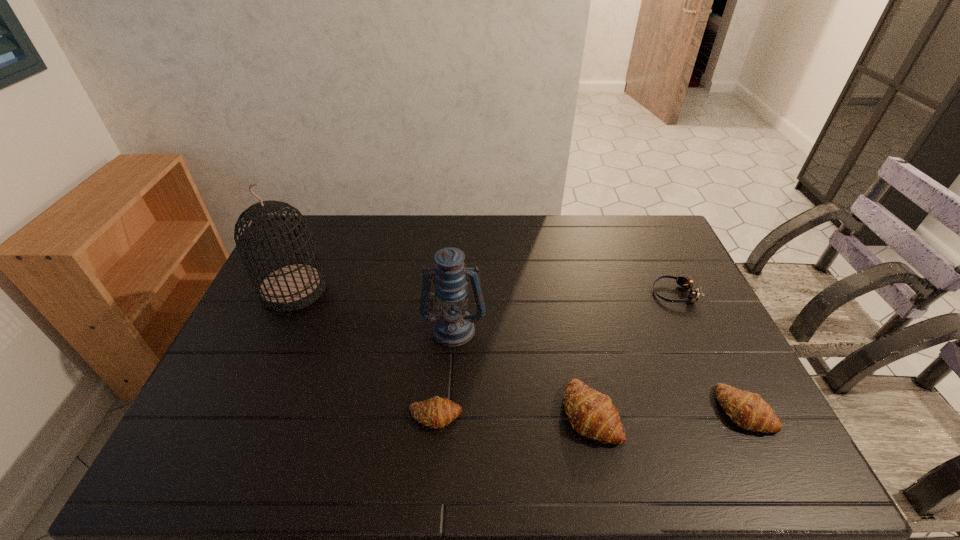
Please show where to add a crescent roll on the left while keeping spacing even. Please provide its 2D coordinates. Your answer should be formatted as a tuple, i.e. [(x, y)], where the tuple contains the x and y coordinates of a point satisfying the conditions above.

[(278, 418)]